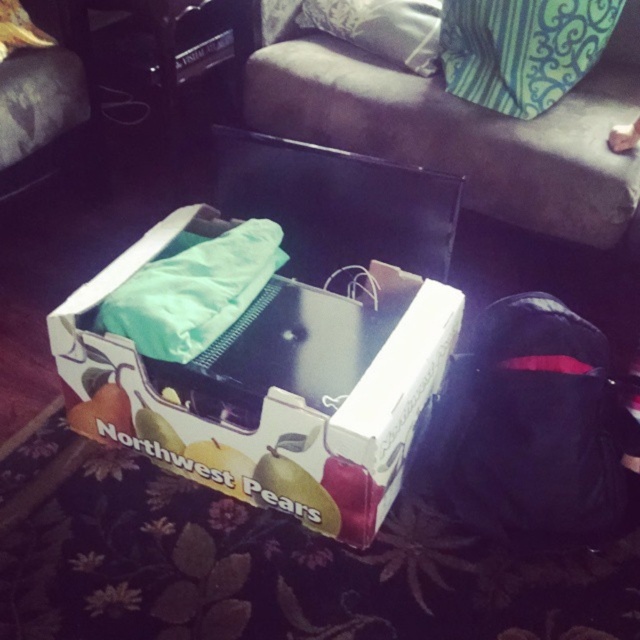
Question: Which point is farther from the camera taking this photo?

Choices:
 (A) (56, 324)
 (B) (394, 189)

Answer: (B)

Question: Can you confirm if white cardboard box at center is bigger than brown fabric couch at upper center?

Choices:
 (A) no
 (B) yes

Answer: (B)

Question: Which of the following is the farthest from the observer?

Choices:
 (A) blue-green fabric pillow at upper center
 (B) dark fabric couch at upper center
 (C) velvety gray pillow at upper center
 (D) brown fabric couch at upper center

Answer: (C)

Question: Which point is closer to the camera?

Choices:
 (A) (404, 54)
 (B) (371, 240)
 (C) (483, 42)
 (D) (64, 32)

Answer: (B)

Question: Is white cardboard box at center further to camera compared to brown fabric couch at upper center?

Choices:
 (A) no
 (B) yes

Answer: (A)

Question: Is blue-green fabric pillow at upper center closer to the viewer compared to velvety gray pillow at upper center?

Choices:
 (A) no
 (B) yes

Answer: (B)